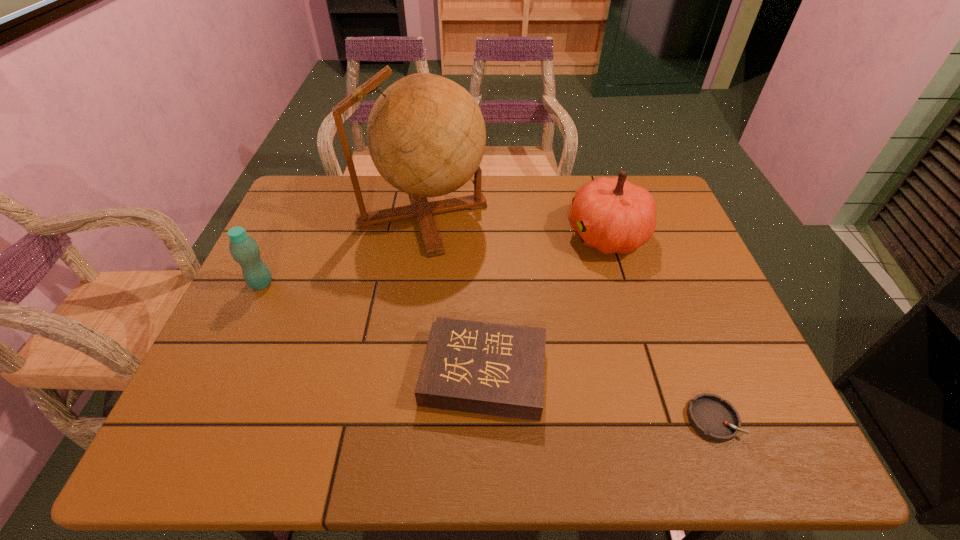
Identify the location of vacant space located at the front cap of the leftmost object. The width and height of the screenshot is (960, 540). (359, 284).

Locate an element on the screen. The height and width of the screenshot is (540, 960). vacant point located 0.050m on the front of the hardback book is located at coordinates coord(485,446).

What are the coordinates of `vacant space positioned 0.390m on the back of the ashtray` in the screenshot? It's located at (654, 266).

Identify the location of globe located at the far edge. This screenshot has height=540, width=960. (426, 135).

Identify the location of pumpkin that is at the far edge. (612, 215).

You are a GUI agent. You are given a task and a screenshot of the screen. Output one action in this format:
    pyautogui.click(x=<x>, y=<y>)
    Task: Click on the hardback book that is at the near edge
    
    Given the screenshot: What is the action you would take?
    pyautogui.click(x=494, y=369)

Find the location of a particular element. ashtray situated at the near edge is located at coordinates (713, 418).

The height and width of the screenshot is (540, 960). What are the coordinates of `object present at the left edge` in the screenshot? It's located at coord(244,250).

Locate an element on the screen. pumpkin situated at the right edge is located at coordinates (612, 215).

This screenshot has height=540, width=960. Identify the location of ashtray that is at the right edge. (713, 418).